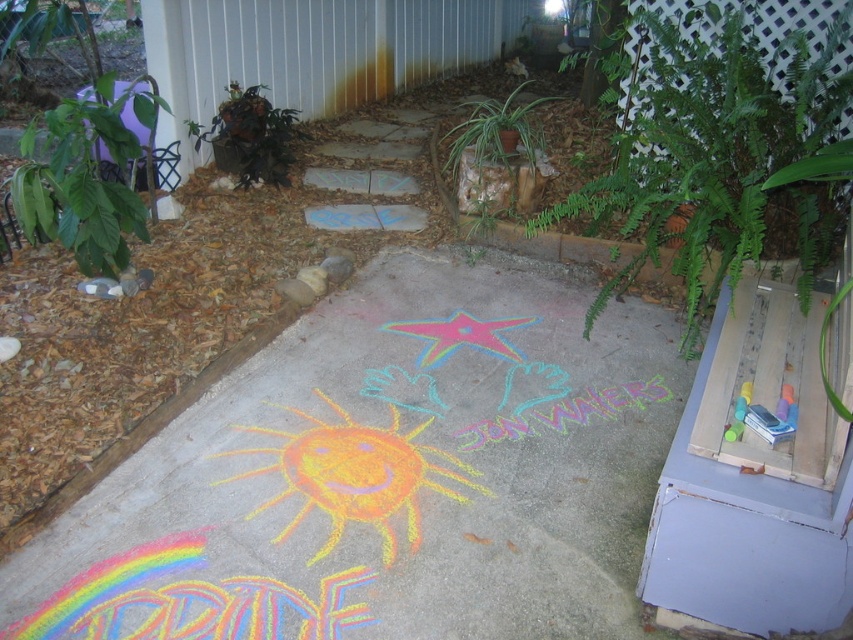
You are standing at the center of the patio and want to place a new potted flower exactly where the green leafy plant at left is currently located. Can you tell me the exact coordinates where you should place the potted flower?

The green leafy plant at left is located at coordinates point (85, 177), so you should place the potted flower there.

Consider the image. You are standing on the patio and want to place a small potted plant between the two points labeled as point [126,100] and point [514,116]. Which point should you place the plant closer to if you want it to be nearer to the camera?

You should place the plant closer to point [126,100] because it is closer to the camera than point [514,116].